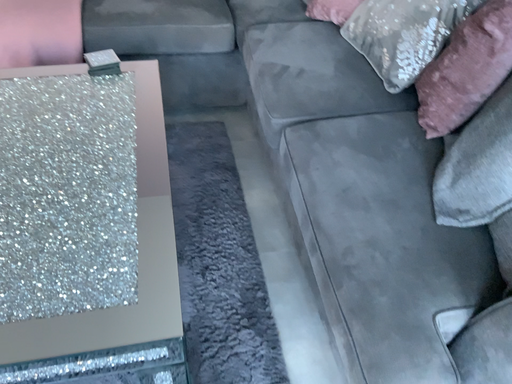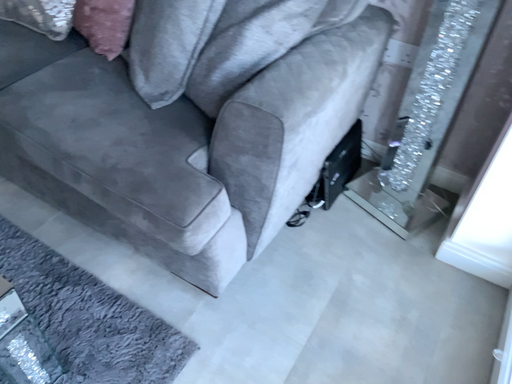
Question: Which way did the camera rotate in the video?

Choices:
 (A) rotated upward
 (B) rotated downward

Answer: (A)